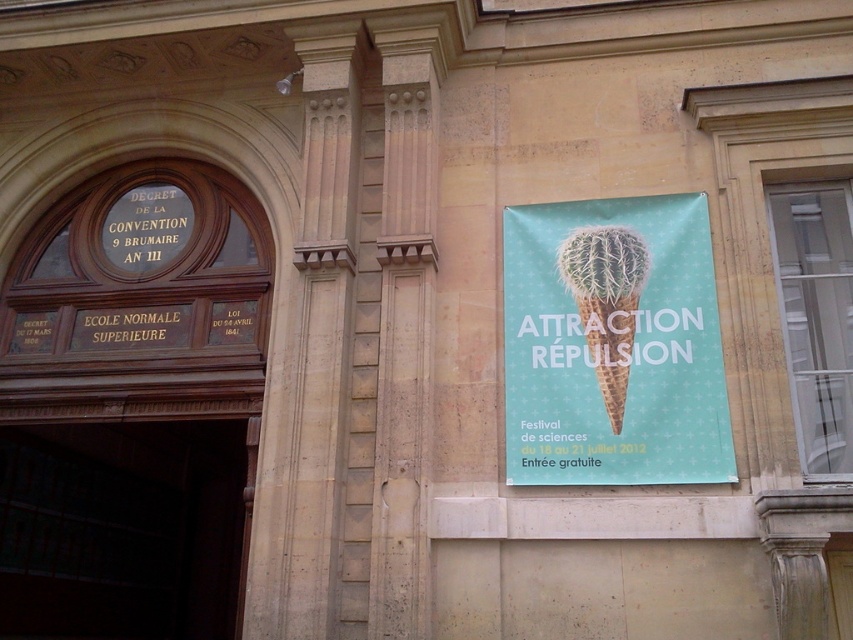
You are an architect designing a new building and want to ensure that the green matte cactus cone at right and the green textured ice cream cone at upper right are visible from the entrance. Given their sizes, which one would appear wider when viewed from the entrance?

The green matte cactus cone at right is wider than the green textured ice cream cone at upper right, so it would appear wider when viewed from the entrance.

From the picture: You are standing in front of the building and notice two green cones on the facade. The first is a green matte cactus cone at right, and the second is a green textured ice cream cone at upper right. Which one is positioned higher up on the building?

The green textured ice cream cone at upper right is positioned higher up on the building than the green matte cactus cone at right.

You are standing in front of the building and see the green matte cactus cone at right and the green textured ice cream cone at upper right. Which object is closer to you?

The green matte cactus cone at right is closer to you because it is in front of the green textured ice cream cone at upper right.